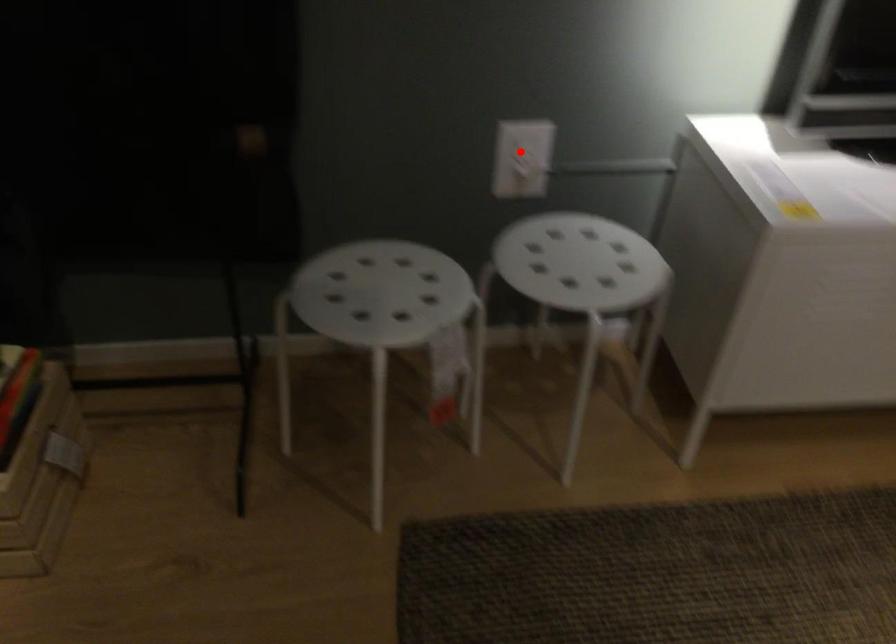
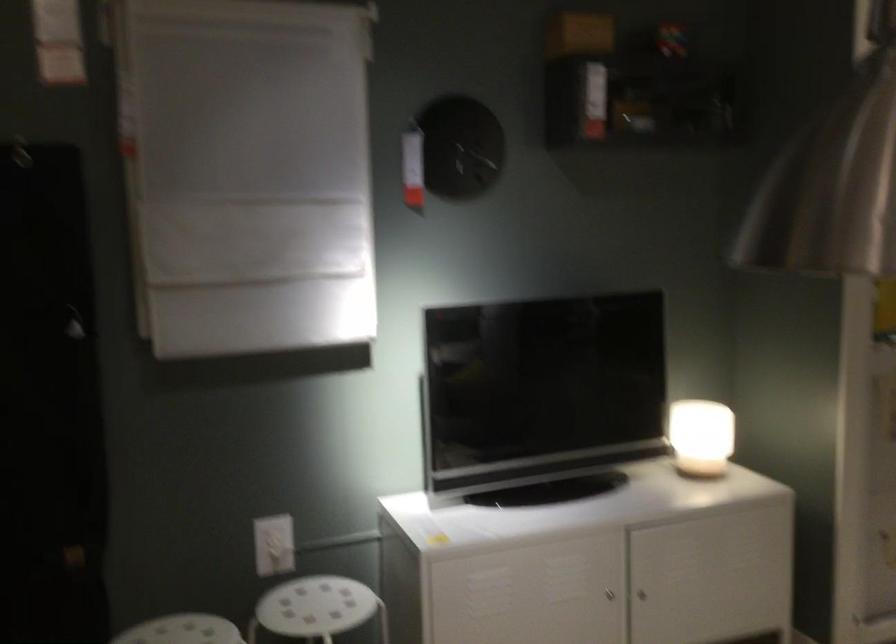
Where in the second image is the point corresponding to the highlighted location from the first image?

(273, 545)